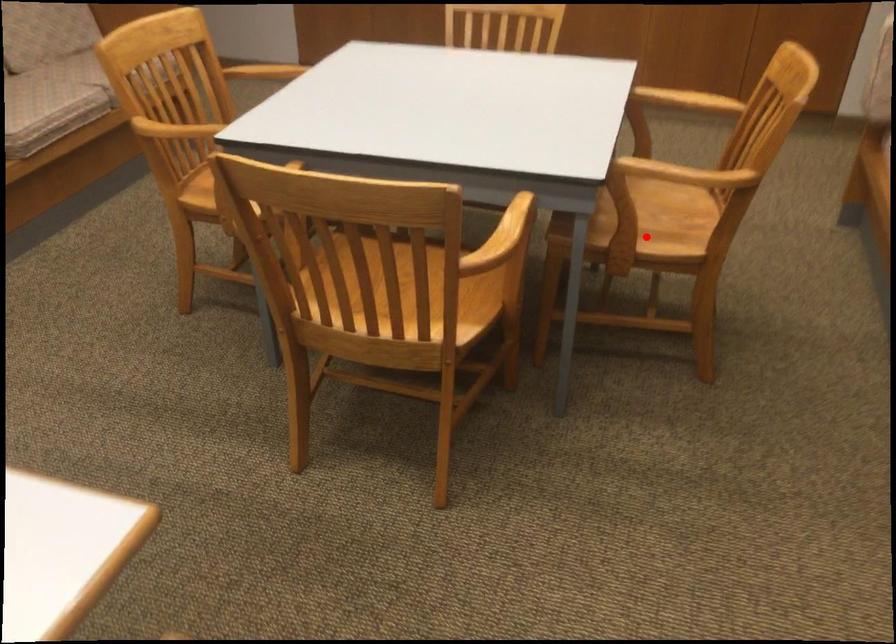
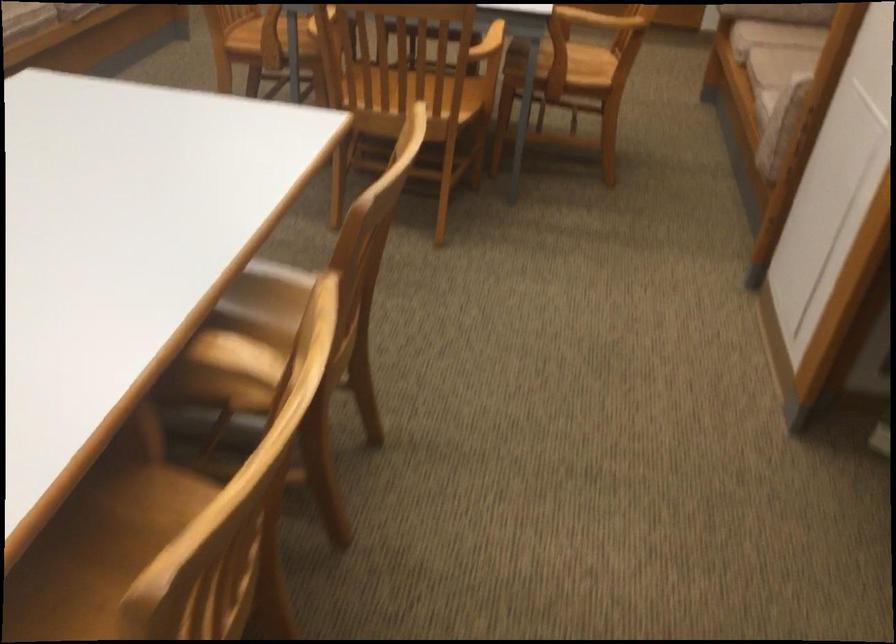
The point at the highlighted location is marked in the first image. Where is the corresponding point in the second image?

(570, 69)